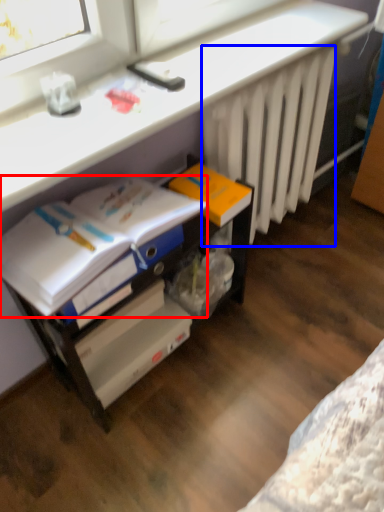
Question: Which of the following is the farthest to the observer, magazine (highlighted by a red box) or radiator (highlighted by a blue box)?

Choices:
 (A) magazine
 (B) radiator

Answer: (B)